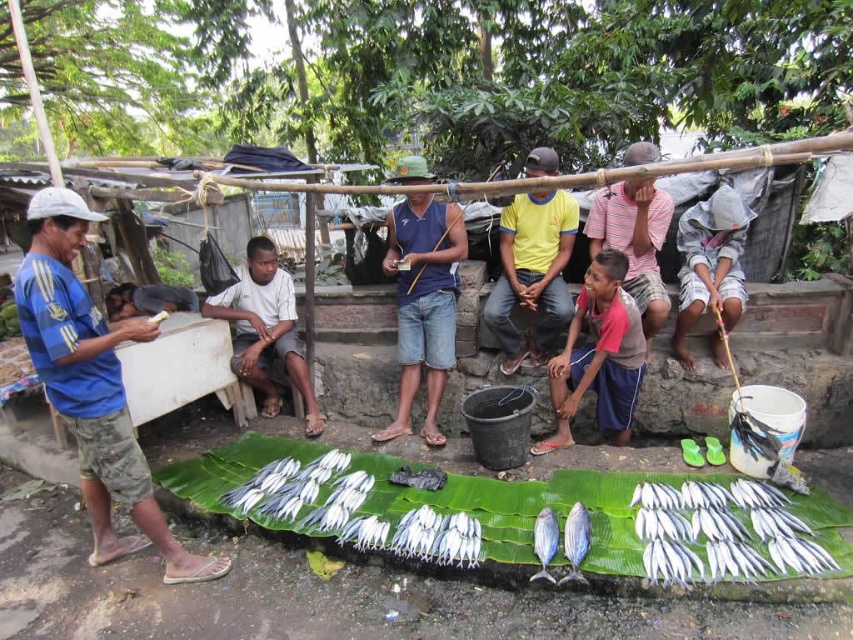
Is dark blue shorts at center bigger than shiny silver fish at center?

Indeed, dark blue shorts at center has a larger size compared to shiny silver fish at center.

Can you confirm if dark blue shorts at center is shorter than shiny silver fish at center?

In fact, dark blue shorts at center may be taller than shiny silver fish at center.

Locate an element on the screen. This screenshot has height=640, width=853. dark blue shorts at center is located at coordinates [x=265, y=330].

Where is `dark blue shorts at center`? The width and height of the screenshot is (853, 640). dark blue shorts at center is located at coordinates 265,330.

Is silver shiny fish at lower center to the left of dark blue shorts at center from the viewer's perspective?

Incorrect, silver shiny fish at lower center is not on the left side of dark blue shorts at center.

Which is more to the left, silver shiny fish at lower center or dark blue shorts at center?

Positioned to the left is dark blue shorts at center.

Does point (755, 499) come behind point (306, 372)?

No.

The width and height of the screenshot is (853, 640). Identify the location of silver shiny fish at lower center. (723, 532).

Who is lower down, blue denim shorts at center or white cotton hat at upper right?

Positioned lower is blue denim shorts at center.

Does blue denim shorts at center come behind white cotton hat at upper right?

Yes, it is.

Identify the location of blue denim shorts at center. (422, 301).